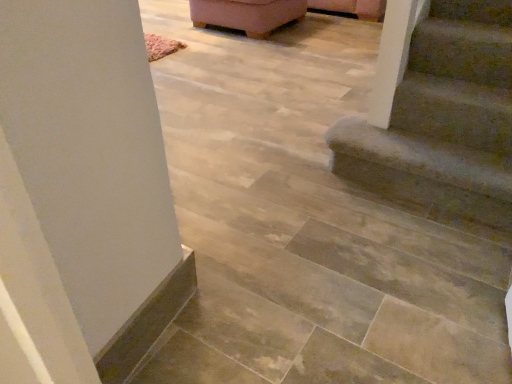
The image size is (512, 384). I want to click on pink fabric ottoman at upper center, so click(x=247, y=14).

The height and width of the screenshot is (384, 512). What do you see at coordinates (247, 14) in the screenshot? I see `pink fabric ottoman at upper center` at bounding box center [247, 14].

This screenshot has height=384, width=512. Describe the element at coordinates (438, 110) in the screenshot. I see `textured carpet stairs at lower right` at that location.

Where is `textured carpet stairs at lower right`? Image resolution: width=512 pixels, height=384 pixels. textured carpet stairs at lower right is located at coordinates (438, 110).

Where is `pink fabric ottoman at upper center`? Image resolution: width=512 pixels, height=384 pixels. pink fabric ottoman at upper center is located at coordinates [247, 14].

Between pink fabric ottoman at upper center and textured carpet stairs at lower right, which one appears on the left side from the viewer's perspective?

pink fabric ottoman at upper center.

Considering the positions of objects pink fabric ottoman at upper center and textured carpet stairs at lower right in the image provided, who is in front, pink fabric ottoman at upper center or textured carpet stairs at lower right?

textured carpet stairs at lower right is closer to the camera.

Considering the points (225, 27) and (377, 123), which point is in front, point (225, 27) or point (377, 123)?

The point (377, 123) is closer.

From the image's perspective, who appears lower, pink fabric ottoman at upper center or textured carpet stairs at lower right?

textured carpet stairs at lower right appears lower in the image.

From a real-world perspective, is pink fabric ottoman at upper center physically above textured carpet stairs at lower right?

Yes, from a real-world perspective, pink fabric ottoman at upper center is above textured carpet stairs at lower right.

Can you confirm if pink fabric ottoman at upper center is thinner than textured carpet stairs at lower right?

No, pink fabric ottoman at upper center is not thinner than textured carpet stairs at lower right.

Considering the sizes of objects pink fabric ottoman at upper center and textured carpet stairs at lower right in the image provided, who is taller, pink fabric ottoman at upper center or textured carpet stairs at lower right?

pink fabric ottoman at upper center.

Is pink fabric ottoman at upper center smaller than textured carpet stairs at lower right?

Actually, pink fabric ottoman at upper center might be larger than textured carpet stairs at lower right.

Would you say pink fabric ottoman at upper center is inside or outside textured carpet stairs at lower right?

pink fabric ottoman at upper center is located beyond the bounds of textured carpet stairs at lower right.

Can you see pink fabric ottoman at upper center touching textured carpet stairs at lower right?

No, pink fabric ottoman at upper center is not making contact with textured carpet stairs at lower right.

Could you tell me if pink fabric ottoman at upper center is facing textured carpet stairs at lower right?

No, pink fabric ottoman at upper center is not oriented towards textured carpet stairs at lower right.

Can you tell me how much pink fabric ottoman at upper center and textured carpet stairs at lower right differ in facing direction?

They differ by 0.585 degrees in their facing directions.

In order to click on stairs below the pink fabric ottoman at upper center (from the image's perspective) in this screenshot , I will do `click(438, 110)`.

In the image, is textured carpet stairs at lower right on the left side or the right side of pink fabric ottoman at upper center?

In the image, textured carpet stairs at lower right appears on the right side of pink fabric ottoman at upper center.

Between textured carpet stairs at lower right and pink fabric ottoman at upper center, which one is positioned in front?

Positioned in front is textured carpet stairs at lower right.

Between point (478, 47) and point (216, 1), which one is positioned in front?

Positioned in front is point (478, 47).

From the image's perspective, is textured carpet stairs at lower right located beneath pink fabric ottoman at upper center?

Correct, textured carpet stairs at lower right appears lower than pink fabric ottoman at upper center in the image.

From a real-world perspective, is textured carpet stairs at lower right positioned above or below pink fabric ottoman at upper center?

From a real-world perspective, textured carpet stairs at lower right is physically below pink fabric ottoman at upper center.

Looking at this image, looking at their sizes, would you say textured carpet stairs at lower right is wider or thinner than pink fabric ottoman at upper center?

Clearly, textured carpet stairs at lower right has less width compared to pink fabric ottoman at upper center.

From their relative heights in the image, would you say textured carpet stairs at lower right is taller or shorter than pink fabric ottoman at upper center?

textured carpet stairs at lower right is shorter than pink fabric ottoman at upper center.

In terms of size, does textured carpet stairs at lower right appear bigger or smaller than pink fabric ottoman at upper center?

textured carpet stairs at lower right is smaller than pink fabric ottoman at upper center.

Does textured carpet stairs at lower right contain pink fabric ottoman at upper center?

No, pink fabric ottoman at upper center is not inside textured carpet stairs at lower right.

Are textured carpet stairs at lower right and pink fabric ottoman at upper center far apart?

textured carpet stairs at lower right is positioned a significant distance from pink fabric ottoman at upper center.

Is textured carpet stairs at lower right positioned with its back to pink fabric ottoman at upper center?

No, textured carpet stairs at lower right is not facing the opposite direction of pink fabric ottoman at upper center.

How many degrees apart are the facing directions of textured carpet stairs at lower right and pink fabric ottoman at upper center?

textured carpet stairs at lower right and pink fabric ottoman at upper center are facing 0.585 degrees away from each other.

Locate an element on the screen. Image resolution: width=512 pixels, height=384 pixels. furniture on the left of textured carpet stairs at lower right is located at coordinates (247, 14).

In the image, there is a pink fabric ottoman at upper center. At what (x,y) coordinates should I click in order to perform the action: click on stairs below it (from a real-world perspective). Please return your answer as a coordinate pair (x, y). The height and width of the screenshot is (384, 512). Looking at the image, I should click on tap(438, 110).

Locate an element on the screen. The height and width of the screenshot is (384, 512). stairs below the pink fabric ottoman at upper center (from the image's perspective) is located at coordinates [x=438, y=110].